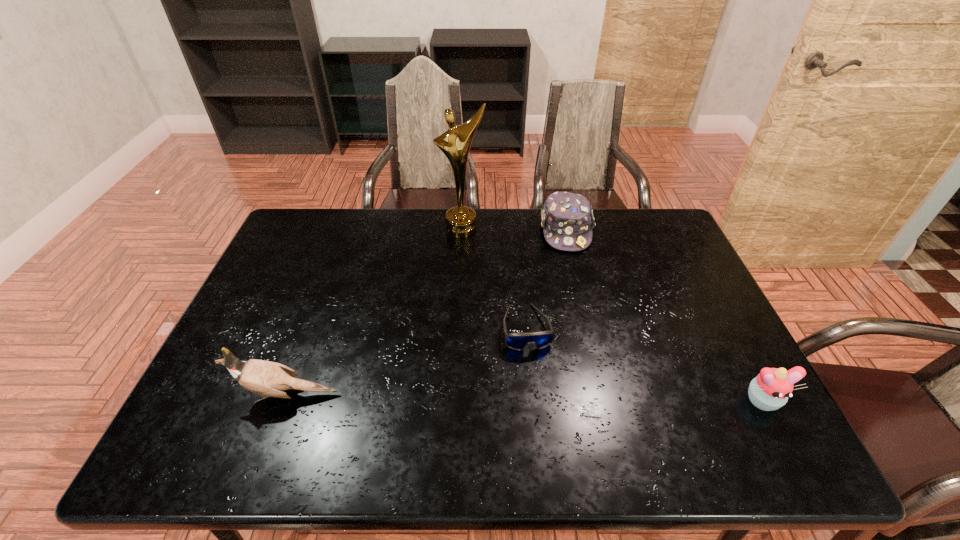
Image resolution: width=960 pixels, height=540 pixels. What are the coordinates of `vacant area located on the front-facing side of the sunglasses` in the screenshot? It's located at (540, 394).

The height and width of the screenshot is (540, 960). In order to click on vacant area situated 0.220m on the front-facing side of the award in this screenshot , I will do `click(483, 282)`.

The width and height of the screenshot is (960, 540). Find the location of `vacant space situated 0.050m on the front-facing side of the award`. vacant space situated 0.050m on the front-facing side of the award is located at coordinates (470, 248).

Identify the location of free space located 0.060m on the front-facing side of the award. Image resolution: width=960 pixels, height=540 pixels. 471,249.

This screenshot has height=540, width=960. Identify the location of vacant space located 0.170m on the front-facing side of the fourth object from left to right. (575, 291).

Where is `free region located 0.350m on the front-facing side of the fourth object from left to right`? The width and height of the screenshot is (960, 540). free region located 0.350m on the front-facing side of the fourth object from left to right is located at coordinates (582, 339).

Where is `free point located on the front-facing side of the fourth object from left to right`? This screenshot has width=960, height=540. free point located on the front-facing side of the fourth object from left to right is located at coordinates (577, 300).

Where is `award at the far edge`? The height and width of the screenshot is (540, 960). award at the far edge is located at coordinates (455, 143).

The image size is (960, 540). Find the location of `headwear that is at the far edge`. headwear that is at the far edge is located at coordinates point(567,220).

Where is `bird at the near edge`? The image size is (960, 540). bird at the near edge is located at coordinates (266, 378).